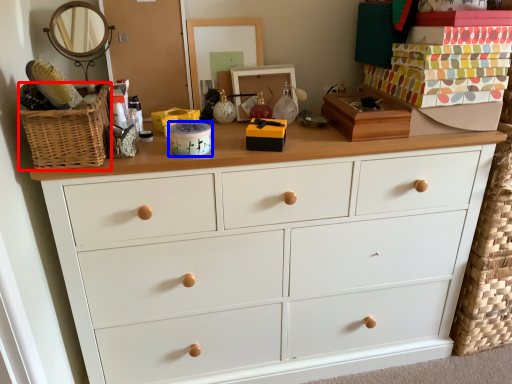
Question: Which object appears closest to the camera in this image, basket (highlighted by a red box) or box (highlighted by a blue box)?

Choices:
 (A) basket
 (B) box

Answer: (A)